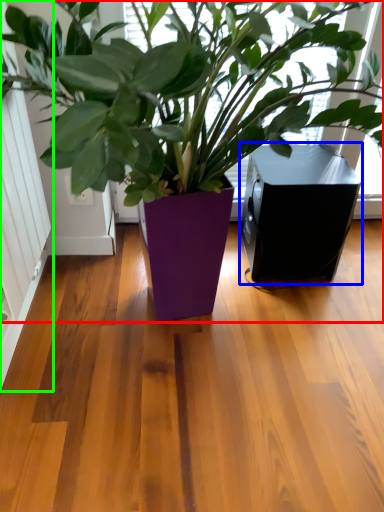
Question: Considering the real-world distances, which object is closest to houseplant (highlighted by a red box)? speaker (highlighted by a blue box) or screen door (highlighted by a green box).

Choices:
 (A) speaker
 (B) screen door

Answer: (A)